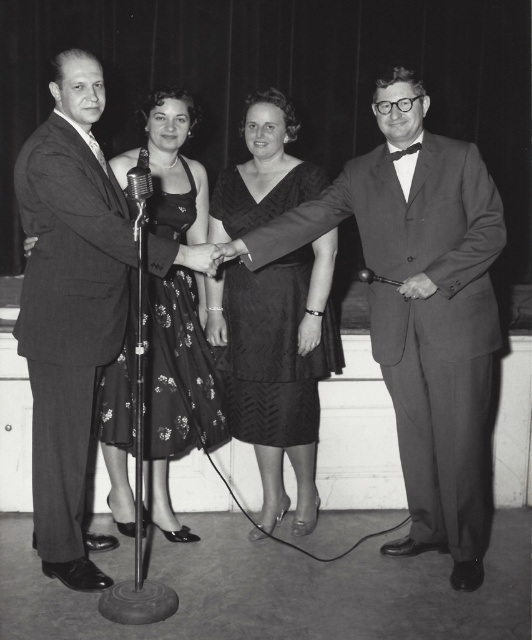
Question: Among these objects, which one is nearest to the camera?

Choices:
 (A) matte black suit at right
 (B) black textured dress at center

Answer: (A)

Question: Does matte black suit at left appear on the right side of black textured dress at center?

Choices:
 (A) yes
 (B) no

Answer: (B)

Question: Can you confirm if black textured dress at center is positioned to the right of floral-patterned fabric dress at center?

Choices:
 (A) yes
 (B) no

Answer: (A)

Question: Which point appears farthest from the camera in this image?

Choices:
 (A) (84, 228)
 (B) (223, 186)

Answer: (B)

Question: Among these points, which one is nearest to the camera?

Choices:
 (A) (300, 360)
 (B) (101, 273)

Answer: (B)

Question: Is matte black suit at right in front of black textured dress at center?

Choices:
 (A) yes
 (B) no

Answer: (A)